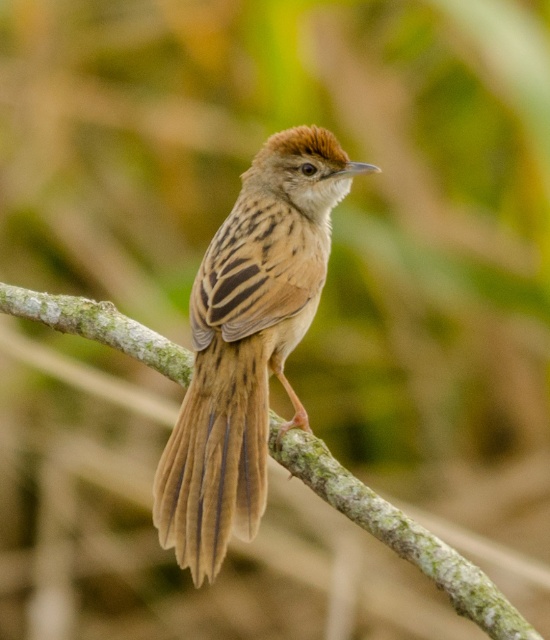
Question: Which point appears farthest from the camera in this image?

Choices:
 (A) (309, 435)
 (B) (196, 380)

Answer: (A)

Question: Is brown feathered sparrow at center to the left of green mossy branch at center from the viewer's perspective?

Choices:
 (A) no
 (B) yes

Answer: (B)

Question: Does brown feathered sparrow at center appear under green mossy branch at center?

Choices:
 (A) yes
 (B) no

Answer: (B)

Question: Can you confirm if brown feathered sparrow at center is positioned to the left of green mossy branch at center?

Choices:
 (A) yes
 (B) no

Answer: (A)